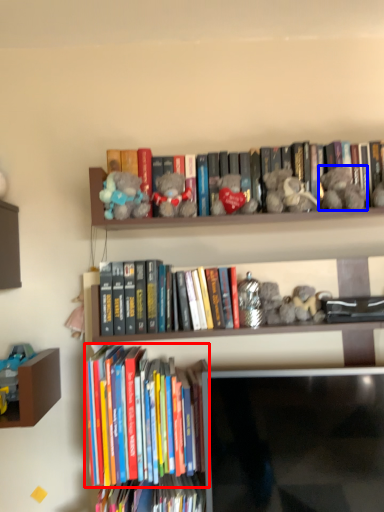
Question: Which object is further to the camera taking this photo, book (highlighted by a red box) or toy (highlighted by a blue box)?

Choices:
 (A) book
 (B) toy

Answer: (B)